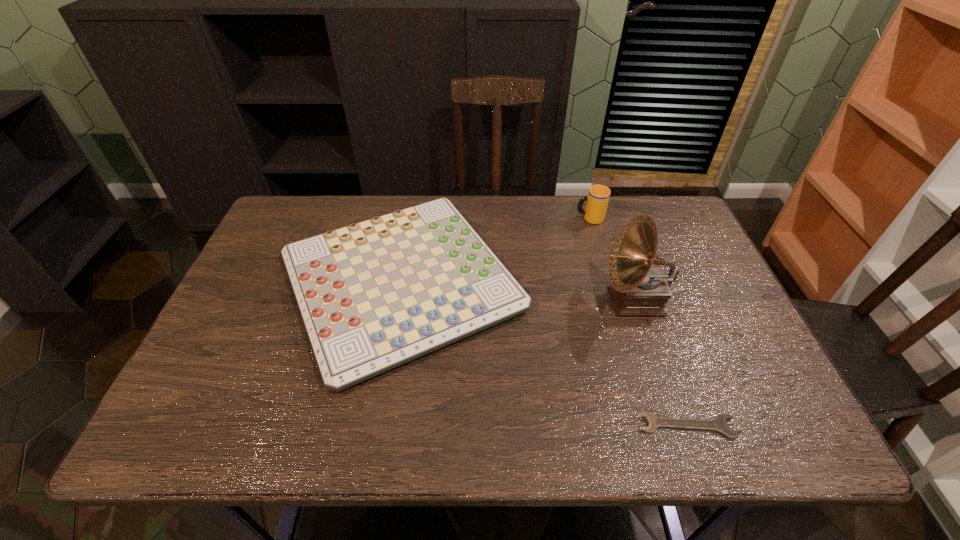
Image resolution: width=960 pixels, height=540 pixels. What are the coordinates of `object that is at the far left corner` in the screenshot? It's located at (374, 295).

Locate an element on the screen. The image size is (960, 540). object that is at the near right corner is located at coordinates (718, 424).

Where is `free location at the far edge of the desktop`? The image size is (960, 540). free location at the far edge of the desktop is located at coordinates (472, 225).

Locate an element on the screen. Image resolution: width=960 pixels, height=540 pixels. free space at the near edge of the desktop is located at coordinates (348, 407).

Image resolution: width=960 pixels, height=540 pixels. Identify the location of free space at the right edge of the desktop. [x=674, y=272].

Locate an element on the screen. free space at the far left corner of the desktop is located at coordinates (266, 235).

The width and height of the screenshot is (960, 540). I want to click on empty space that is in between the phonograph record and the wrench, so click(661, 363).

Image resolution: width=960 pixels, height=540 pixels. Find the location of `empty space between the shortest object and the third tallest object`. empty space between the shortest object and the third tallest object is located at coordinates (544, 354).

Find the location of a particular element. free space that is in between the tallest object and the shortest object is located at coordinates (661, 363).

You are a GUI agent. You are given a task and a screenshot of the screen. Output one action in this format:
    pyautogui.click(x=<x>, y=<y>)
    Task: Click on the free space between the nearest object and the phonograph record
    The width and height of the screenshot is (960, 540).
    Given the screenshot: What is the action you would take?
    pyautogui.click(x=661, y=363)